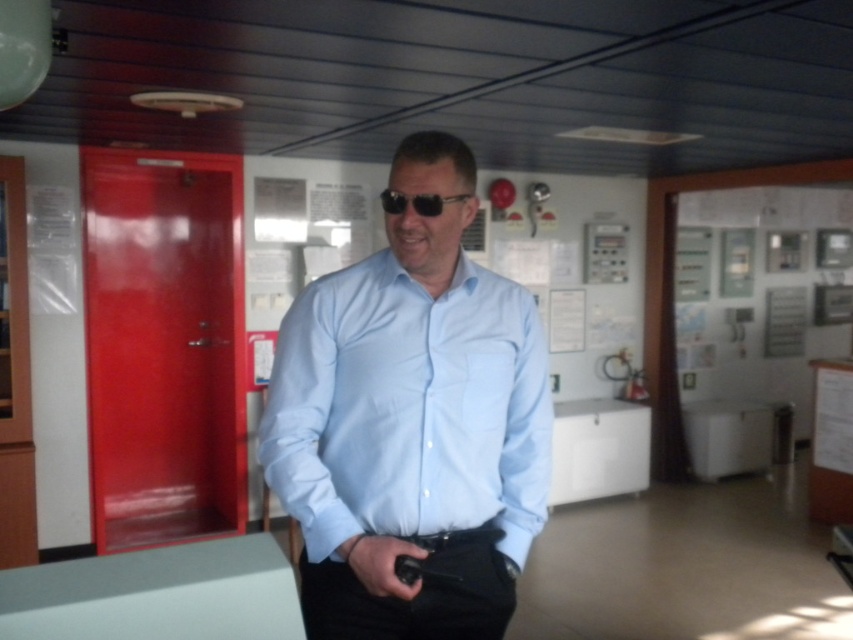
Question: Which of the following is the farthest from the observer?

Choices:
 (A) black plastic sunglasses at center
 (B) black matte gun at lower center

Answer: (A)

Question: Which point is closer to the camera taking this photo?

Choices:
 (A) (334, 508)
 (B) (403, 596)

Answer: (B)

Question: Can you confirm if black matte gun at lower center is positioned to the right of black plastic sunglasses at center?

Choices:
 (A) no
 (B) yes

Answer: (A)

Question: Which point is farther to the camera?

Choices:
 (A) (460, 195)
 (B) (389, 388)

Answer: (A)

Question: Considering the relative positions of black matte gun at lower center and black plastic sunglasses at center in the image provided, where is black matte gun at lower center located with respect to black plastic sunglasses at center?

Choices:
 (A) above
 (B) below

Answer: (B)

Question: Does light blue shirt at center appear over black matte gun at lower center?

Choices:
 (A) yes
 (B) no

Answer: (A)